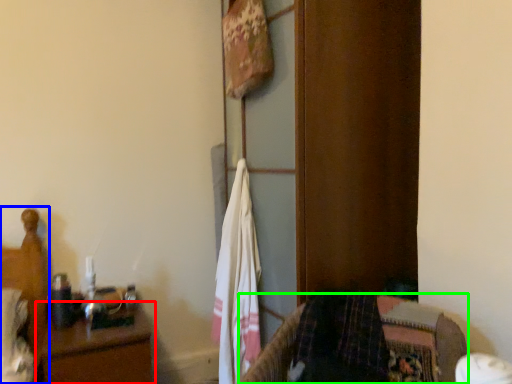
Question: Considering the real-world distances, which object is closest to nightstand (highlighted by a red box)? bed (highlighted by a blue box) or furniture (highlighted by a green box).

Choices:
 (A) bed
 (B) furniture

Answer: (A)